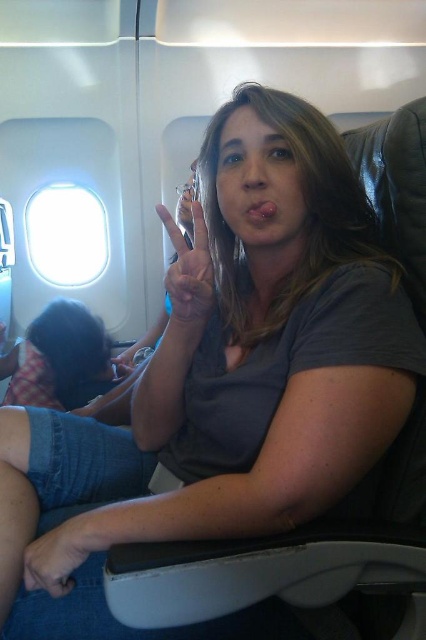
From the picture: You are a passenger seated in the airplane cabin and want to know which object is wider between the transparent glass airplane window at upper left and the matte silver ring at center. Can you determine which one is wider?

The transparent glass airplane window at upper left is wider than the matte silver ring at center according to the description.

You are a passenger sitting in the airplane cabin. You notice the transparent glass airplane window at upper left and the matte silver ring at center. Which object is positioned higher in the scene?

The transparent glass airplane window at upper left is positioned higher than the matte silver ring at center because it is located above it.